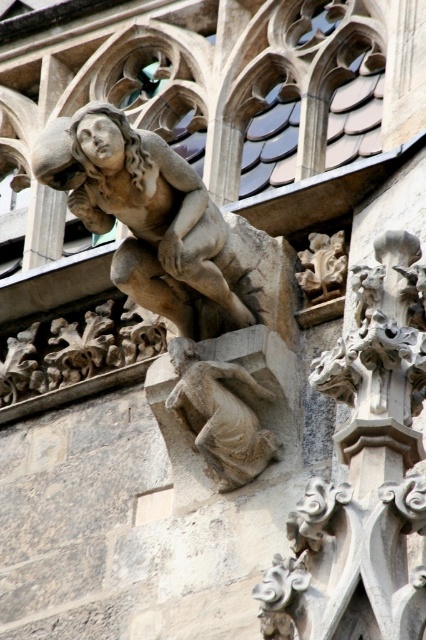
You are an architect examining the Gothic structure and need to determine the visibility of two points marked on the structure. Given that you are standing at the base of the structure facing it, which of the two points, point (x=247, y=474) or point (x=307, y=236), is closer to you?

Point (x=247, y=474) is in front of point (x=307, y=236), so it is closer to you when standing at the base facing the structure.

You are an architect examining the Gothic structure. You notice two gargoyles, the stone gargoyle at lower center and the white stone gargoyle at upper right. Which gargoyle occupies more horizontal space in the image?

The stone gargoyle at lower center occupies more horizontal space because its width is larger than that of the white stone gargoyle at upper right.